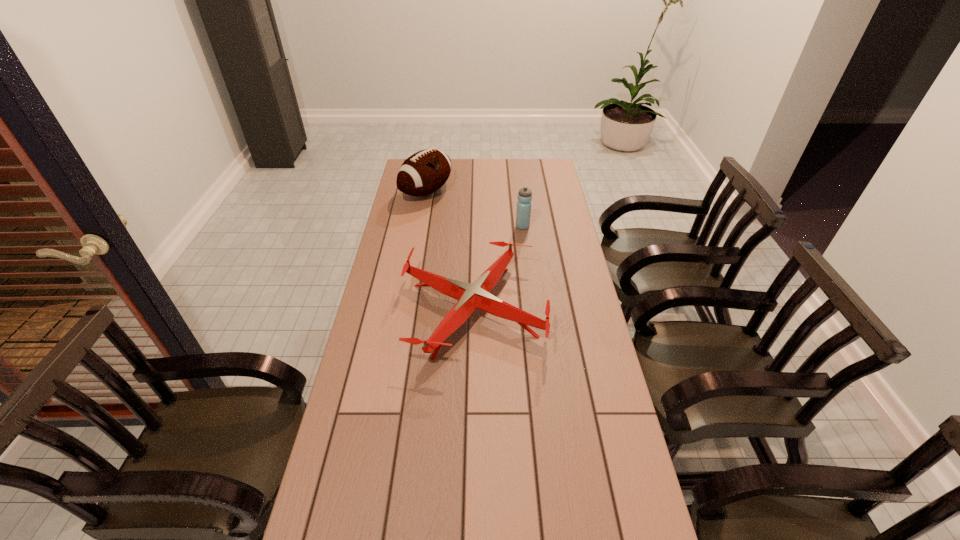
Image resolution: width=960 pixels, height=540 pixels. Find the location of `the farthest object`. the farthest object is located at coordinates (423, 173).

Image resolution: width=960 pixels, height=540 pixels. In order to click on the second farthest object in this screenshot , I will do `click(523, 214)`.

Where is `the nearest object`? the nearest object is located at coordinates (470, 297).

At what (x,y) coordinates should I click in order to perform the action: click on the shortest object. Please return your answer as a coordinate pair (x, y). The image size is (960, 540). Looking at the image, I should click on (470, 297).

The height and width of the screenshot is (540, 960). What are the coordinates of `vacant region located on the right of the football (American)` in the screenshot? It's located at (491, 192).

Image resolution: width=960 pixels, height=540 pixels. I want to click on free region located on the back of the water bottle, so click(520, 204).

You are a GUI agent. You are given a task and a screenshot of the screen. Output one action in this format:
    pyautogui.click(x=<x>, y=<y>)
    Task: Click on the free spot located on the front of the shortest object
    The height and width of the screenshot is (540, 960).
    Given the screenshot: What is the action you would take?
    pyautogui.click(x=471, y=447)

The image size is (960, 540). What are the coordinates of `object present at the far edge` in the screenshot? It's located at (423, 173).

The height and width of the screenshot is (540, 960). Find the location of `football (American) that is at the left edge`. football (American) that is at the left edge is located at coordinates (423, 173).

At what (x,y) coordinates should I click in order to perform the action: click on drone that is at the left edge. Please return your answer as a coordinate pair (x, y). The width and height of the screenshot is (960, 540). Looking at the image, I should click on (470, 297).